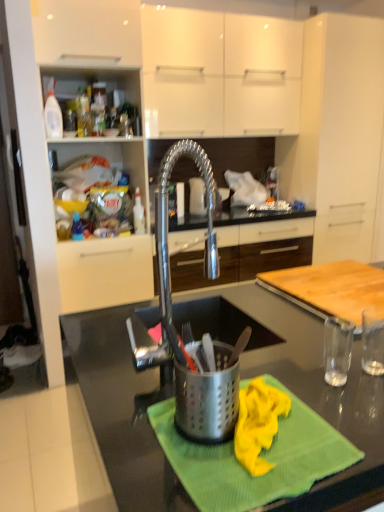
Question: Considering the relative positions of green textured cloth at center and polished stainless steel faucet at center in the image provided, is green textured cloth at center to the left of polished stainless steel faucet at center from the viewer's perspective?

Choices:
 (A) no
 (B) yes

Answer: (A)

Question: Considering the relative sizes of green textured cloth at center and polished stainless steel faucet at center in the image provided, is green textured cloth at center thinner than polished stainless steel faucet at center?

Choices:
 (A) yes
 (B) no

Answer: (B)

Question: From a real-world perspective, is green textured cloth at center located higher than polished stainless steel faucet at center?

Choices:
 (A) no
 (B) yes

Answer: (A)

Question: Could you tell me if green textured cloth at center is facing polished stainless steel faucet at center?

Choices:
 (A) yes
 (B) no

Answer: (B)

Question: Is the depth of green textured cloth at center less than that of polished stainless steel faucet at center?

Choices:
 (A) yes
 (B) no

Answer: (A)

Question: Does green textured cloth at center have a greater width compared to polished stainless steel faucet at center?

Choices:
 (A) no
 (B) yes

Answer: (B)

Question: Is satin nickel faucet at center, positioned as the 3th cabinetry in top-to-bottom order, far from wooden cutting board at right?

Choices:
 (A) yes
 (B) no

Answer: (A)

Question: From the image's perspective, does satin nickel faucet at center, the 1th cabinetry ordered from the bottom, appear lower than wooden cutting board at right?

Choices:
 (A) no
 (B) yes

Answer: (A)

Question: Can you confirm if satin nickel faucet at center, the 1th cabinetry ordered from the bottom, is wider than wooden cutting board at right?

Choices:
 (A) yes
 (B) no

Answer: (A)

Question: Considering the relative sizes of satin nickel faucet at center, the 1th cabinetry ordered from the bottom, and wooden cutting board at right in the image provided, is satin nickel faucet at center, the 1th cabinetry ordered from the bottom, thinner than wooden cutting board at right?

Choices:
 (A) no
 (B) yes

Answer: (A)

Question: Is satin nickel faucet at center, the 1th cabinetry ordered from the bottom, oriented away from wooden cutting board at right?

Choices:
 (A) no
 (B) yes

Answer: (A)

Question: From a real-world perspective, is satin nickel faucet at center, positioned as the 3th cabinetry in top-to-bottom order, physically above wooden cutting board at right?

Choices:
 (A) yes
 (B) no

Answer: (B)

Question: Does green textured cloth at center touch metallic gray countertop at center?

Choices:
 (A) no
 (B) yes

Answer: (A)